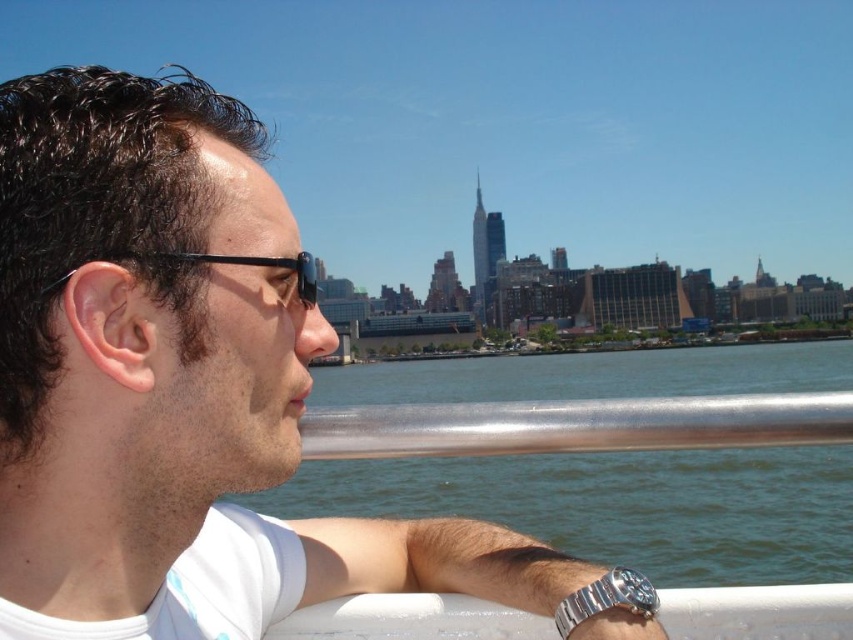
Question: Which object is the farthest from the silver metallic watch at lower right?

Choices:
 (A) black plastic goggles at left
 (B) clear blue water at center
 (C) white matte shirt at center

Answer: (B)

Question: Among these points, which one is nearest to the camera?

Choices:
 (A) (850, 362)
 (B) (175, 547)
 (C) (247, 260)

Answer: (B)

Question: Is the position of white matte shirt at center less distant than that of clear blue water at center?

Choices:
 (A) yes
 (B) no

Answer: (A)

Question: Which of the following is the farthest from the observer?

Choices:
 (A) black plastic goggles at left
 (B) silver metallic watch at lower right
 (C) silver metallic rail at center
 (D) white matte shirt at center

Answer: (C)

Question: Is silver metallic rail at center bigger than silver metallic watch at lower right?

Choices:
 (A) no
 (B) yes

Answer: (B)

Question: Can you confirm if silver metallic rail at center is thinner than black plastic goggles at left?

Choices:
 (A) yes
 (B) no

Answer: (B)